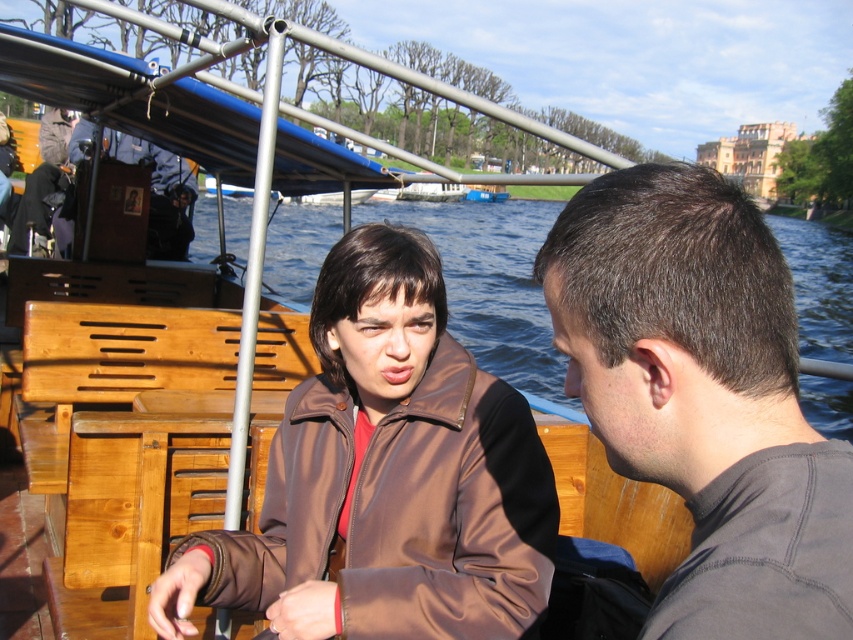
You are a photographer on the boat and want to take a photo of the person in the brown satin jacket at center and the person with dark brown hair at right. Which person should you focus on first if you want to capture both in the same frame without moving the camera?

The brown satin jacket at center is positioned on the left side of dark brown hair at right, so you should focus on the brown satin jacket at center first as it is closer to the left side, allowing both subjects to be in the frame without moving the camera.

You are standing on the boat and need to locate the brown satin jacket at center. According to the coordinates provided, where exactly would you find it?

The brown satin jacket at center is located at coordinates point (386, 476).